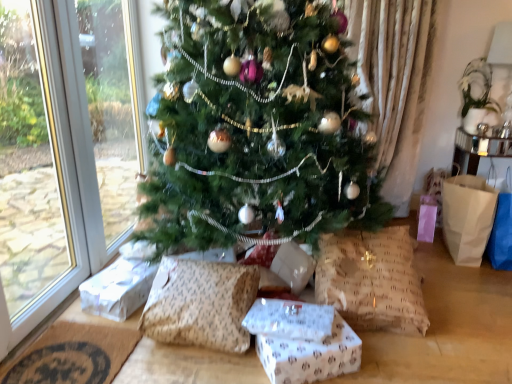
Question: Can you confirm if green matte christmas tree at center is smaller than brown textured pillow at lower center, which appears as the second pillow when viewed from the right?

Choices:
 (A) yes
 (B) no

Answer: (B)

Question: Is green matte christmas tree at center not within brown textured pillow at lower center, marked as the first pillow in a left-to-right arrangement?

Choices:
 (A) yes
 (B) no

Answer: (A)

Question: Does green matte christmas tree at center come in front of brown textured pillow at lower center, which appears as the second pillow when viewed from the right?

Choices:
 (A) no
 (B) yes

Answer: (B)

Question: Is green matte christmas tree at center wider than brown textured pillow at lower center, which appears as the second pillow when viewed from the right?

Choices:
 (A) no
 (B) yes

Answer: (B)

Question: Considering the relative sizes of green matte christmas tree at center and brown textured pillow at lower center, which appears as the second pillow when viewed from the right, in the image provided, is green matte christmas tree at center taller than brown textured pillow at lower center, which appears as the second pillow when viewed from the right,?

Choices:
 (A) yes
 (B) no

Answer: (A)

Question: Considering the positions of white paper gift at lower left, which ranks as the first gift box in left-to-right order, and green matte christmas tree at center in the image, is white paper gift at lower left, which ranks as the first gift box in left-to-right order, taller or shorter than green matte christmas tree at center?

Choices:
 (A) tall
 (B) short

Answer: (B)

Question: From the image's perspective, relative to green matte christmas tree at center, is white paper gift at lower left, placed as the second gift box when sorted from front to back, above or below?

Choices:
 (A) below
 (B) above

Answer: (A)

Question: Do you think white paper gift at lower left, which ranks as the first gift box in left-to-right order, is within green matte christmas tree at center, or outside of it?

Choices:
 (A) outside
 (B) inside

Answer: (A)

Question: Looking at their shapes, would you say white paper gift at lower left, marked as the second gift box in a right-to-left arrangement, is wider or thinner than green matte christmas tree at center?

Choices:
 (A) wide
 (B) thin

Answer: (B)

Question: In the image, is brown textured pillow at lower center, marked as the first pillow in a left-to-right arrangement, positioned in front of or behind white paper gift at center, acting as the first gift box starting from the front?

Choices:
 (A) front
 (B) behind

Answer: (B)

Question: Considering the positions of brown textured pillow at lower center, marked as the first pillow in a left-to-right arrangement, and white paper gift at center, which is counted as the 2th gift box, starting from the left, in the image, is brown textured pillow at lower center, marked as the first pillow in a left-to-right arrangement, taller or shorter than white paper gift at center, which is counted as the 2th gift box, starting from the left,?

Choices:
 (A) tall
 (B) short

Answer: (A)

Question: Is brown textured pillow at lower center, which appears as the second pillow when viewed from the right, wider or thinner than white paper gift at center, placed as the first gift box when sorted from right to left?

Choices:
 (A) wide
 (B) thin

Answer: (A)

Question: Is brown textured pillow at lower center, marked as the first pillow in a left-to-right arrangement, inside or outside of white paper gift at center, acting as the first gift box starting from the front?

Choices:
 (A) inside
 (B) outside

Answer: (B)

Question: From a real-world perspective, is white paper gift at lower left, which ranks as the first gift box in left-to-right order, above or below brown woven mat at lower left?

Choices:
 (A) below
 (B) above

Answer: (B)

Question: Is white paper gift at lower left, placed as the second gift box when sorted from front to back, wider or thinner than brown woven mat at lower left?

Choices:
 (A) wide
 (B) thin

Answer: (B)